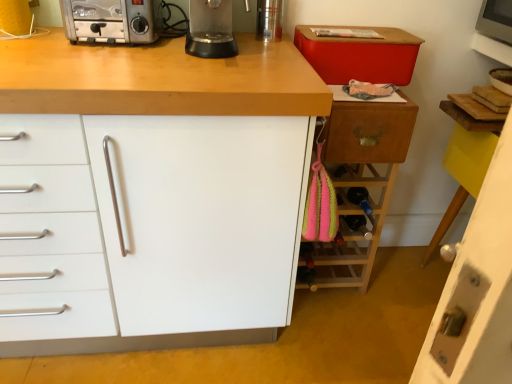
Where is `vacant area that lies between white glossy door at lower right, the third cabinetry in the left-to-right sequence, and wooden wine rack at right, the 2th cabinetry positioned from the right`? vacant area that lies between white glossy door at lower right, the third cabinetry in the left-to-right sequence, and wooden wine rack at right, the 2th cabinetry positioned from the right is located at coordinates (390, 293).